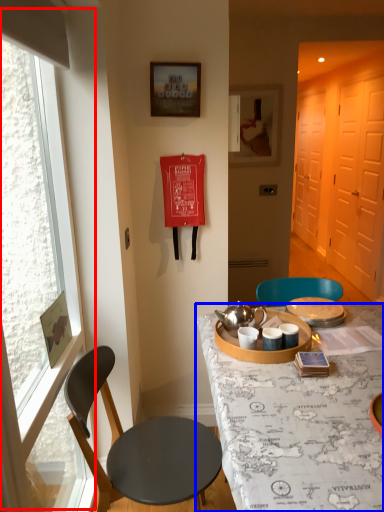
Question: Which object is closer to the camera taking this photo, window (highlighted by a red box) or desk (highlighted by a blue box)?

Choices:
 (A) window
 (B) desk

Answer: (A)